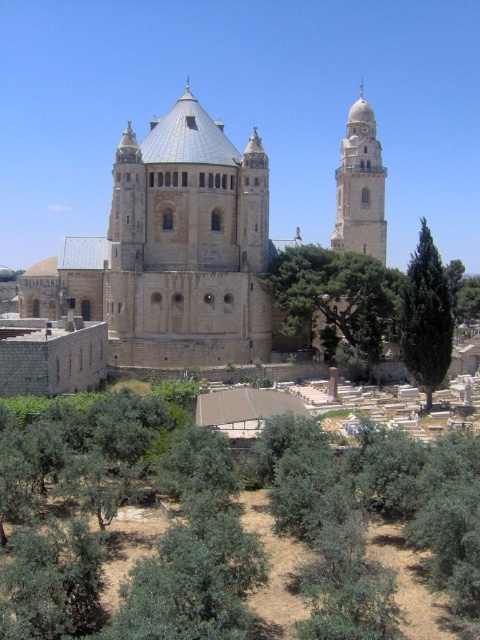
Question: Which object is positioned farthest from the smooth stone tower at upper right?

Choices:
 (A) green leafy tree at center
 (B) green leafy tree at lower left

Answer: (B)

Question: Which object is closer to the camera taking this photo?

Choices:
 (A) green leafy tree at center
 (B) smooth stone tower at upper right
 (C) beige stone church at center

Answer: (C)

Question: Can you confirm if green leafy tree at lower right is positioned above green textured tree at right?

Choices:
 (A) no
 (B) yes

Answer: (B)

Question: Is smooth stone tower at upper right thinner than green textured tree at right?

Choices:
 (A) yes
 (B) no

Answer: (B)

Question: Estimate the real-world distances between objects in this image. Which object is closer to the beige stone church at center?

Choices:
 (A) green textured tree at right
 (B) green leafy tree at lower right
 (C) green leafy tree at lower left
 (D) smooth stone tower at upper right

Answer: (B)

Question: Considering the relative positions of green leafy tree at lower right and smooth stone tower at upper right in the image provided, where is green leafy tree at lower right located with respect to smooth stone tower at upper right?

Choices:
 (A) right
 (B) left

Answer: (B)